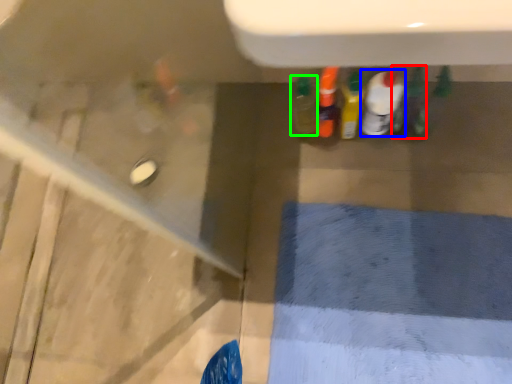
Question: Considering the real-world distances, which object is farthest from bottle (highlighted by a red box)? bottle (highlighted by a blue box) or bottle (highlighted by a green box)?

Choices:
 (A) bottle
 (B) bottle

Answer: (B)